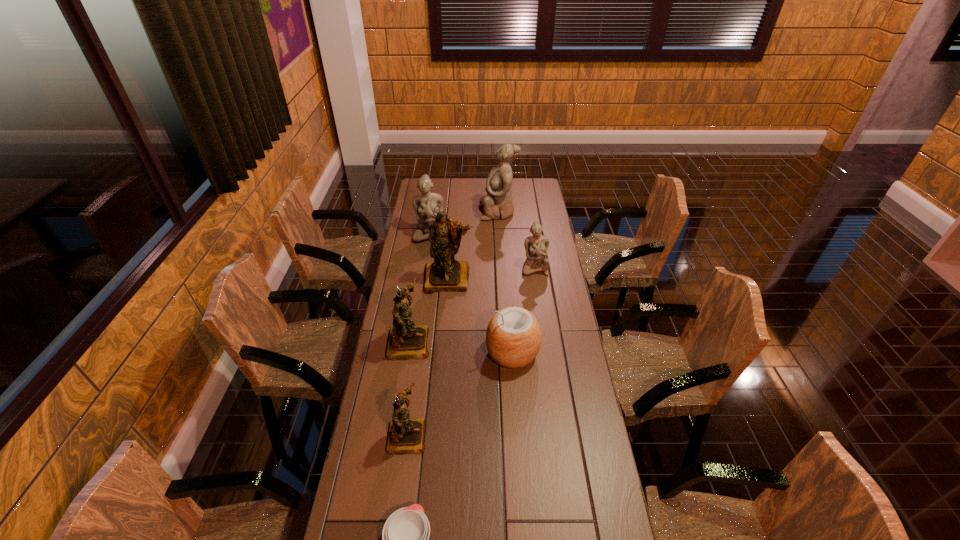
This screenshot has height=540, width=960. What are the coordinates of `the seventh farthest object` in the screenshot? It's located at (405, 435).

This screenshot has width=960, height=540. In order to click on vacant space situated 0.180m on the front-facing side of the farthest white figurine in this screenshot , I will do (x=445, y=212).

Where is `vacant region located on the front-facing side of the farthest white figurine`? This screenshot has width=960, height=540. vacant region located on the front-facing side of the farthest white figurine is located at coordinates (459, 212).

I want to click on free point located 0.050m on the front-facing side of the farthest white figurine, so tap(470, 212).

Identify the location of vacant space situated 0.190m on the front-facing side of the farthest gold figurine. This screenshot has width=960, height=540. (444, 327).

Identify the location of vacant point located on the front-facing side of the second farthest white figurine. (424, 270).

In order to click on free space located on the front-facing side of the second smallest gold figurine in this screenshot , I will do `click(491, 342)`.

The width and height of the screenshot is (960, 540). Find the location of `free spot located 0.070m on the left of the coconut`. free spot located 0.070m on the left of the coconut is located at coordinates (467, 353).

This screenshot has height=540, width=960. What are the coordinates of `free space located on the front-facing side of the smallest white figurine` in the screenshot? It's located at (544, 336).

You are a GUI agent. You are given a task and a screenshot of the screen. Output one action in this format:
    pyautogui.click(x=<x>, y=<y>)
    Task: Click on the free location located on the front-facing side of the smallest gold figurine
    Image resolution: width=960 pixels, height=540 pixels.
    Given the screenshot: What is the action you would take?
    pyautogui.click(x=506, y=435)